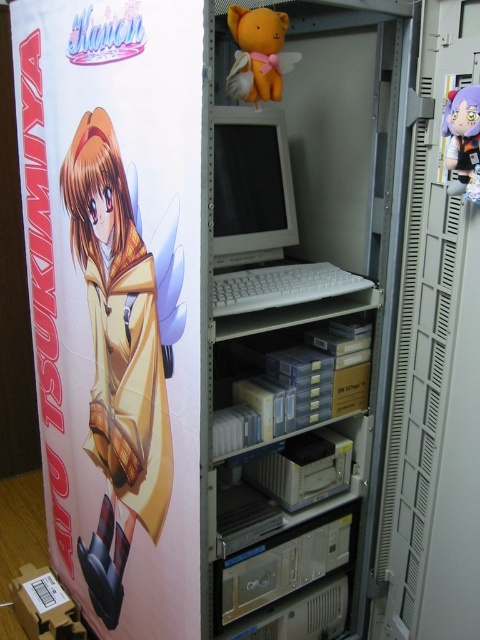
Image resolution: width=480 pixels, height=640 pixels. What do you see at coordinates (116, 298) in the screenshot?
I see `matte paper poster at left` at bounding box center [116, 298].

Who is more forward, [110,340] or [467,104]?

Point [467,104] is in front.

Identify the location of matte paper poster at left. (116, 298).

Locate an element on the screen. The width and height of the screenshot is (480, 640). matte paper poster at left is located at coordinates (116, 298).

Which is below, matte yellow plush at upper center or plush purple doll at right?

plush purple doll at right is lower down.

The height and width of the screenshot is (640, 480). I want to click on matte yellow plush at upper center, so click(257, 52).

Does matte white monitor at center come behind matte yellow plush at upper center?

No, it is in front of matte yellow plush at upper center.

The height and width of the screenshot is (640, 480). What do you see at coordinates (251, 186) in the screenshot?
I see `matte white monitor at center` at bounding box center [251, 186].

At what (x,y) coordinates should I click in order to perform the action: click on matte white monitor at center. Please return your answer as a coordinate pair (x, y). The height and width of the screenshot is (640, 480). Looking at the image, I should click on (251, 186).